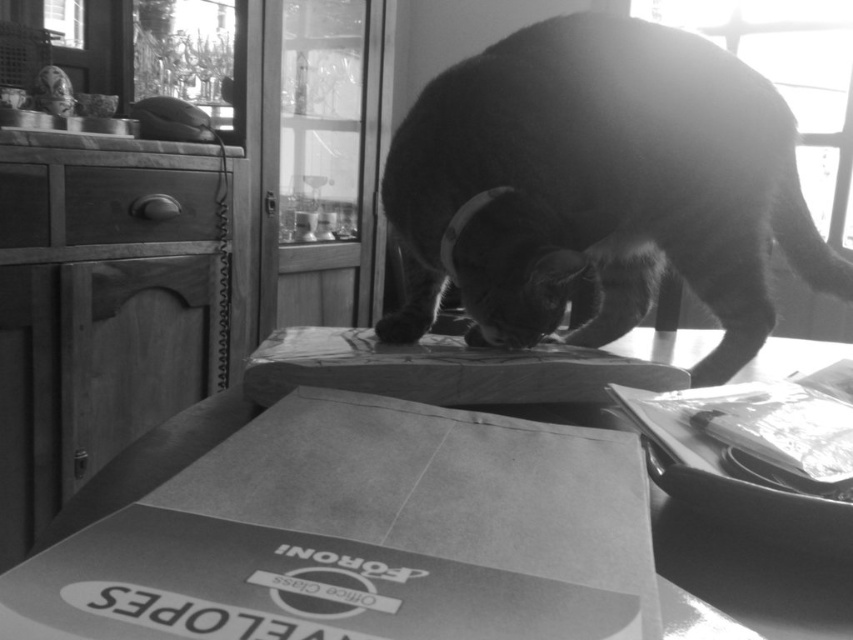
You are a delivery person who just placed a package on the table. There are two points marked on the table. The first point is at coordinate point (376, 337) and the second point is at coordinate point (264, 401). If the cat is currently sitting at the second point, which point is closer to the edge of the table?

Point (264, 401) is closer to the edge of the table because it is in front of point (376, 337), which is behind it. Since the cat is at the second point, it is closer to the edge.

You are a delivery person who needs to place a new package on the table. The new package is 12 inches long. There is already a smooth cardboard envelope at center and a cardboard box at center on the table. Can the new package fit between them without overlapping?

The smooth cardboard envelope at center is 10.69 inches from the cardboard box at center. Since the new package is 12 inches long, which is longer than the space between them, it cannot fit between them without overlapping.

You are a delivery person who just arrived at a house. You see a cat on a table and a point marked at coordinate (x=364, y=534). What is located at that point?

The point at coordinate (x=364, y=534) indicates a smooth cardboard envelope at center.